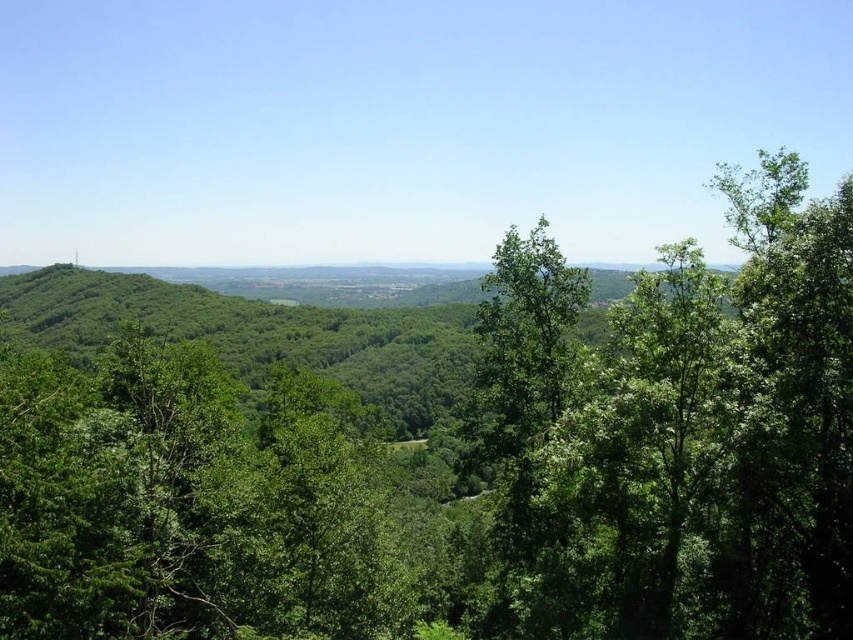
You are an environmental researcher studying tree sizes in this landscape. You observe the green leafy tree at upper right and the green leafy tree at center. Which tree has a wider spread of branches?

The green leafy tree at upper right has a larger width than the green leafy tree at center, so it has a wider spread of branches.

You are standing at the bottom of the valley and want to take a photo that includes both the green leafy tree at upper right and the green leafy tree at center. Which tree should you position closer to the front of your photo to ensure both are in frame?

Since the green leafy tree at upper right is much taller than the green leafy tree at center, you should position the shorter green leafy tree at center closer to the front of your photo. This way, the taller tree in the background won t block the shorter one, ensuring both are visible in the frame.

You are standing at the center of the valley and want to locate the green leafy tree at upper right. According to the coordinates provided, in which cardinal direction should you look to find it?

The green leafy tree at upper right is located at coordinates point (701, 445), which corresponds to the upper right direction from your position at the center of the valley.